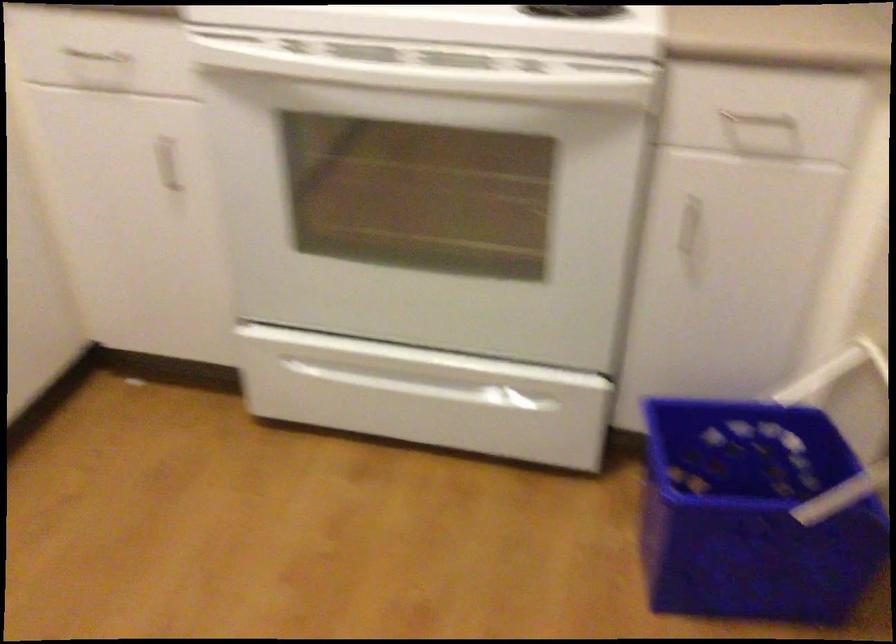
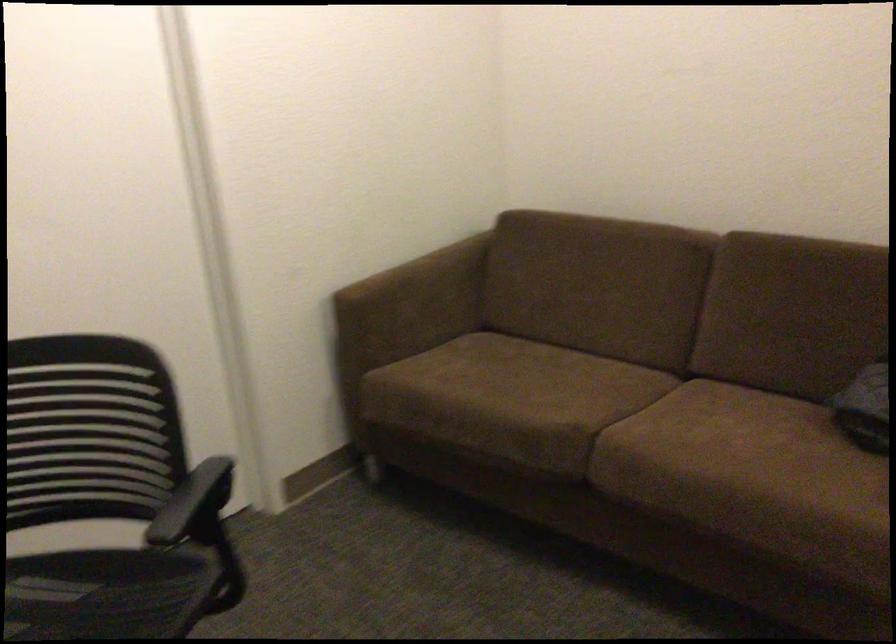
How did the camera likely rotate?

The camera's rotation is toward left-down.